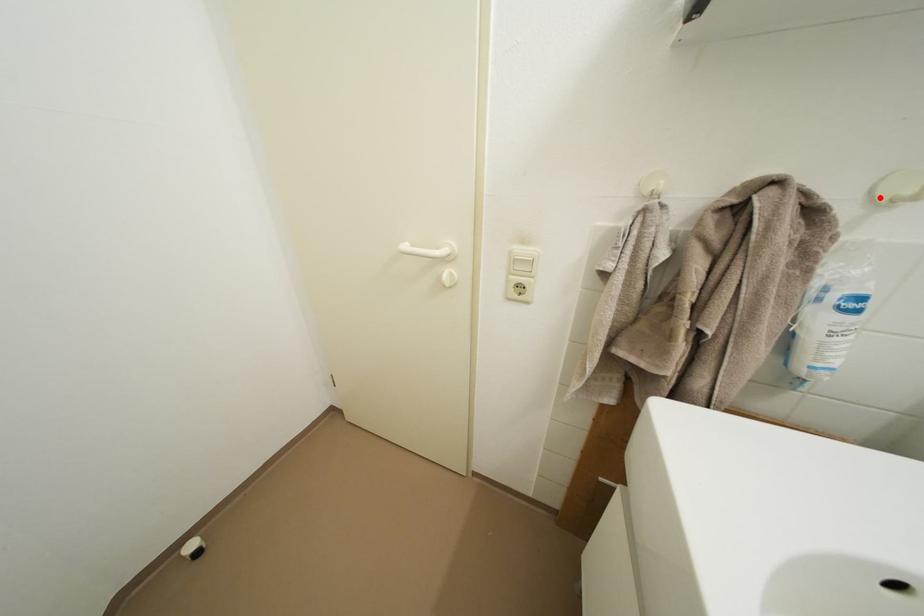
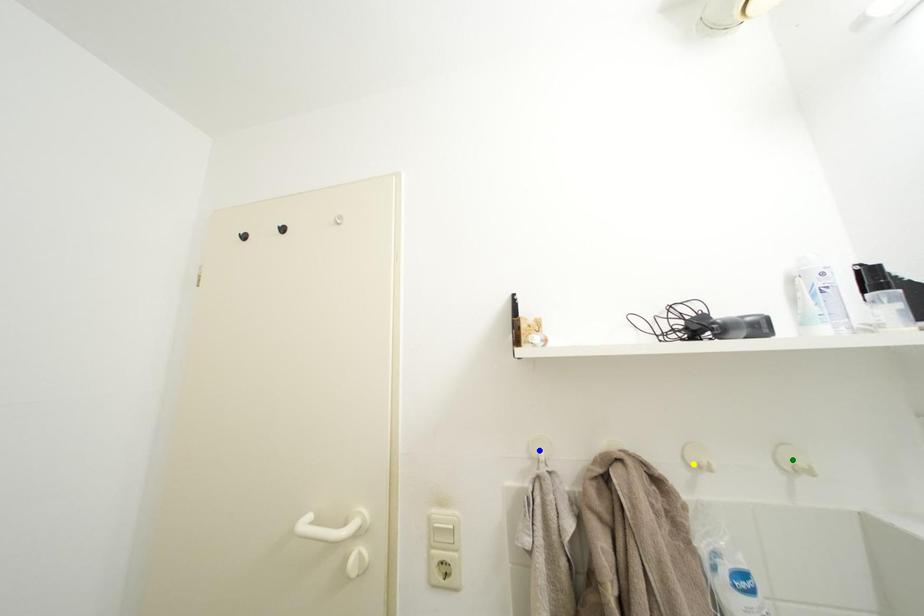
Question: I am providing you with two images of the same scene from different viewpoints. A red point is marked on the first image. You are given multiple points on the second image. Which spot in image 2 lines up with the point in image 1?

Choices:
 (A) yellow point
 (B) green point
 (C) blue point

Answer: (A)